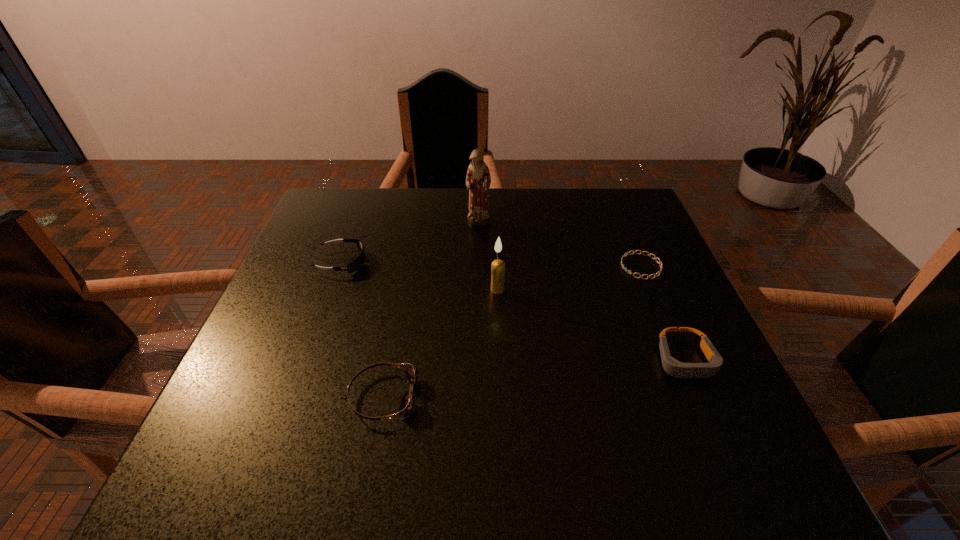
Locate an element on the screen. This screenshot has width=960, height=540. the second closest goggles relative to the second goggles from left to right is located at coordinates (673, 367).

Where is `vacant area in the image that satisfies the following two spatial constraints: 1. on the front-facing side of the figurine; 2. through the lenses of the second object from left to right`? The width and height of the screenshot is (960, 540). vacant area in the image that satisfies the following two spatial constraints: 1. on the front-facing side of the figurine; 2. through the lenses of the second object from left to right is located at coordinates (478, 396).

Image resolution: width=960 pixels, height=540 pixels. I want to click on free space that satisfies the following two spatial constraints: 1. on the front-facing side of the figurine; 2. through the lenses of the second goggles from right to left, so click(478, 396).

Identify the location of free point that satisfies the following two spatial constraints: 1. on the front-facing side of the tallest object; 2. through the lenses of the second object from left to right. This screenshot has height=540, width=960. (478, 396).

At what (x,y) coordinates should I click in order to perform the action: click on vacant space that satisfies the following two spatial constraints: 1. on the front-facing side of the figurine; 2. on the front and sides of the farthest goggles. Please return your answer as a coordinate pair (x, y). Looking at the image, I should click on (478, 262).

Image resolution: width=960 pixels, height=540 pixels. What are the coordinates of `free region that satisfies the following two spatial constraints: 1. on the front-facing side of the candle; 2. on the right side of the farthest object` in the screenshot? It's located at (478, 289).